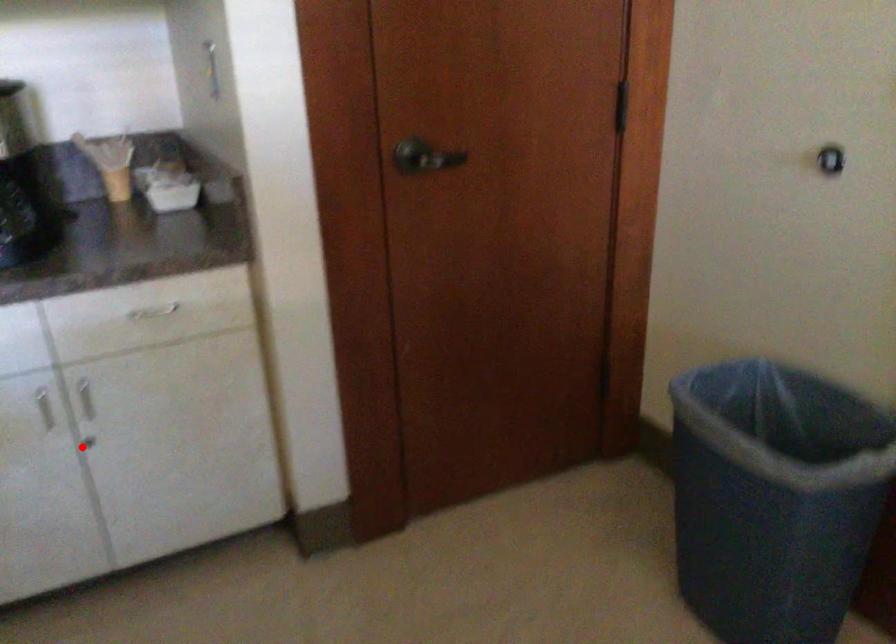
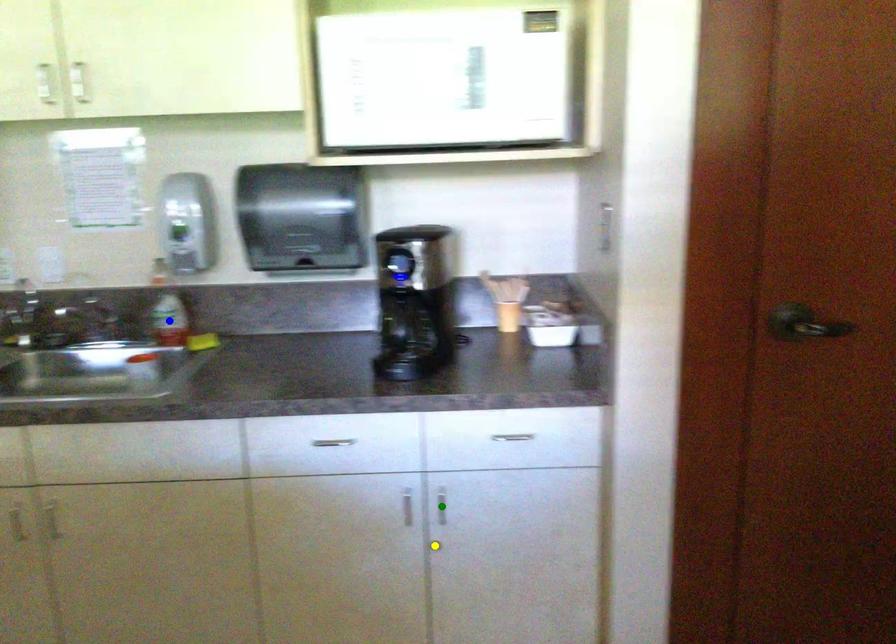
Question: I am providing you with two images of the same scene from different viewpoints. A red point is marked on the first image. You are given multiple points on the second image. Can you choose the point in image 2 that corresponds to the point in image 1?

Choices:
 (A) green point
 (B) blue point
 (C) yellow point

Answer: (C)